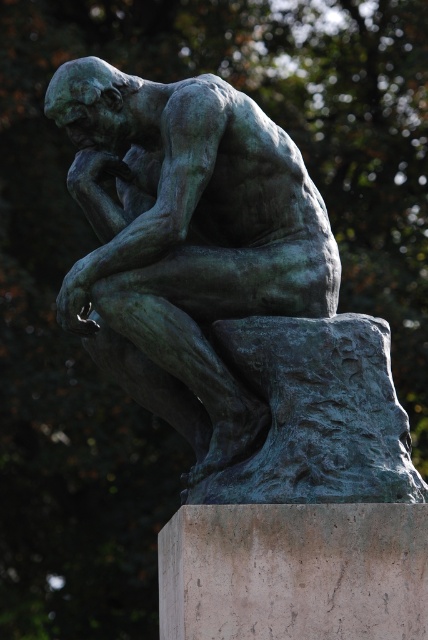
You are an art conservator assessing the stability of the green patina bronze statue at center and the marble pedestal at lower center. Based on their positions, which object is positioned higher relative to the other?

The green patina bronze statue at center is located above the marble pedestal at lower center, so it is positioned higher.

Looking at this image, you are a tour guide explaining the sculpture to visitors. You want to point out the relationship between the green patina bronze statue at center and the marble pedestal at lower center. Which one is positioned behind the other?

The marble pedestal at lower center is positioned behind the green patina bronze statue at center.